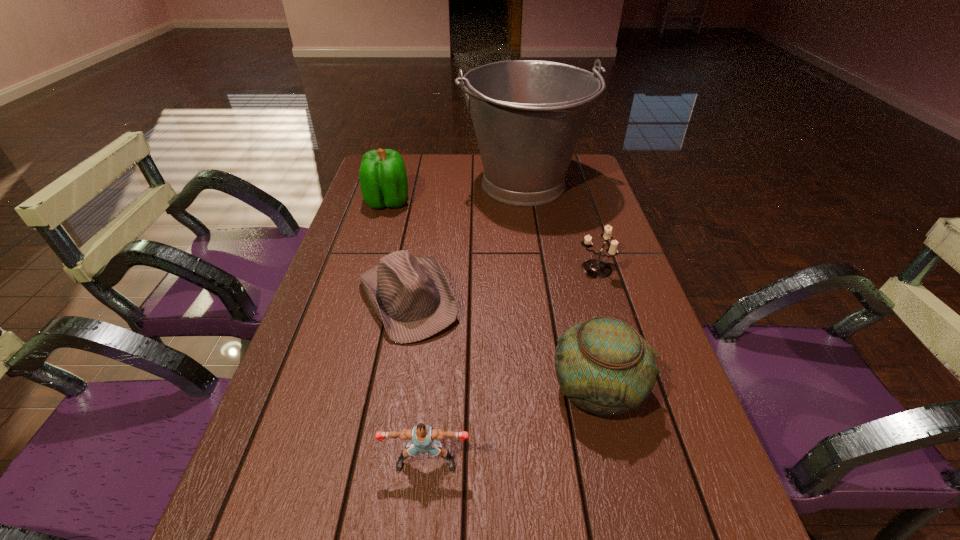
This screenshot has height=540, width=960. I want to click on vacant space located 0.160m on the front of the candle holder, so click(612, 328).

Identify the location of vacant space located on the front-facing side of the puncher. This screenshot has width=960, height=540. (420, 523).

You are a GUI agent. You are given a task and a screenshot of the screen. Output one action in this format:
    pyautogui.click(x=<x>, y=<y>)
    Task: Click on the free space located 0.230m on the right of the fedora
    
    Given the screenshot: What is the action you would take?
    click(x=556, y=299)

I want to click on object located at the far edge, so click(x=528, y=115).

I want to click on bell pepper that is at the left edge, so click(x=383, y=179).

Find the location of a particular element. fedora situated at the left edge is located at coordinates [x=411, y=296].

Identify the location of bucket located at the right edge. Image resolution: width=960 pixels, height=540 pixels. (528, 115).

Identify the location of pottery located at the right edge. This screenshot has width=960, height=540. pyautogui.click(x=603, y=365).

Identify the location of candle holder located at the right edge. (595, 268).

Find the location of a particular element. The width and height of the screenshot is (960, 540). object present at the far right corner is located at coordinates (528, 115).